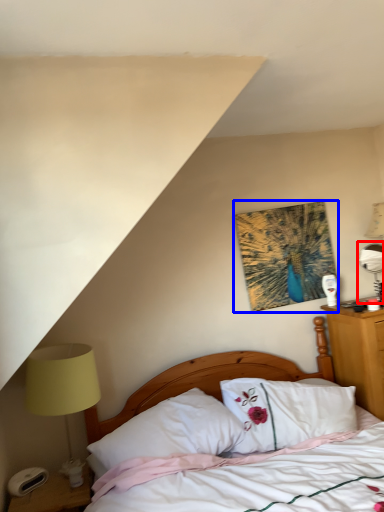
Question: Which of the following is the closest to the observer, table lamp (highlighted by a red box) or picture frame (highlighted by a blue box)?

Choices:
 (A) table lamp
 (B) picture frame

Answer: (B)